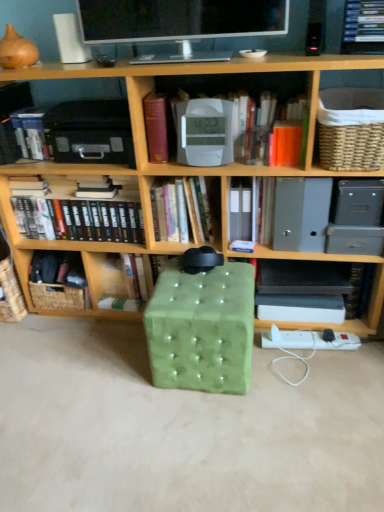
Question: Is woven brown basket at lower left, which ranks as the second basket in top-to-bottom order, bigger than hardcover book at center, which ranks as the 3th book in left-to-right order?

Choices:
 (A) no
 (B) yes

Answer: (B)

Question: Considering the relative sizes of woven brown basket at lower left, acting as the 1th basket starting from the bottom, and hardcover book at center, which ranks as the 3th book in left-to-right order, in the image provided, is woven brown basket at lower left, acting as the 1th basket starting from the bottom, taller than hardcover book at center, which ranks as the 3th book in left-to-right order,?

Choices:
 (A) yes
 (B) no

Answer: (B)

Question: From the image's perspective, would you say woven brown basket at lower left, acting as the 1th basket starting from the bottom, is shown under hardcover book at center, which is the 4th book from right to left?

Choices:
 (A) no
 (B) yes

Answer: (B)

Question: From a real-world perspective, is woven brown basket at lower left, the 1th basket in the left-to-right sequence, on top of hardcover book at center, which ranks as the 3th book in left-to-right order?

Choices:
 (A) yes
 (B) no

Answer: (B)

Question: Considering the relative positions of woven brown basket at lower left, the second basket in the right-to-left sequence, and hardcover book at center, which is the 4th book from right to left, in the image provided, is woven brown basket at lower left, the second basket in the right-to-left sequence, to the right of hardcover book at center, which is the 4th book from right to left, from the viewer's perspective?

Choices:
 (A) no
 (B) yes

Answer: (A)

Question: Is woven brown basket at lower left, positioned as the 1th basket in back-to-front order, at the left side of hardcover book at center, which ranks as the 3th book in left-to-right order?

Choices:
 (A) yes
 (B) no

Answer: (A)

Question: Is wooden bookshelf at center not within hardcover books at center, positioned as the fifth book in right-to-left order?

Choices:
 (A) no
 (B) yes

Answer: (B)

Question: Considering the relative sizes of wooden bookshelf at center and hardcover books at center, which appears as the second book when viewed from the left, in the image provided, is wooden bookshelf at center smaller than hardcover books at center, which appears as the second book when viewed from the left,?

Choices:
 (A) yes
 (B) no

Answer: (B)

Question: From the image's perspective, is wooden bookshelf at center located beneath hardcover books at center, which appears as the second book when viewed from the left?

Choices:
 (A) yes
 (B) no

Answer: (B)

Question: Is wooden bookshelf at center facing away from hardcover books at center, which appears as the second book when viewed from the left?

Choices:
 (A) yes
 (B) no

Answer: (A)

Question: Is wooden bookshelf at center aimed at hardcover books at center, positioned as the fifth book in right-to-left order?

Choices:
 (A) no
 (B) yes

Answer: (B)

Question: Considering the relative positions of wooden bookshelf at center and hardcover books at center, positioned as the fifth book in right-to-left order, in the image provided, is wooden bookshelf at center in front of hardcover books at center, positioned as the fifth book in right-to-left order,?

Choices:
 (A) no
 (B) yes

Answer: (B)

Question: Does green velvet ottoman at center appear on the left side of hardcover book at center, which ranks as the 3th book in left-to-right order?

Choices:
 (A) yes
 (B) no

Answer: (B)